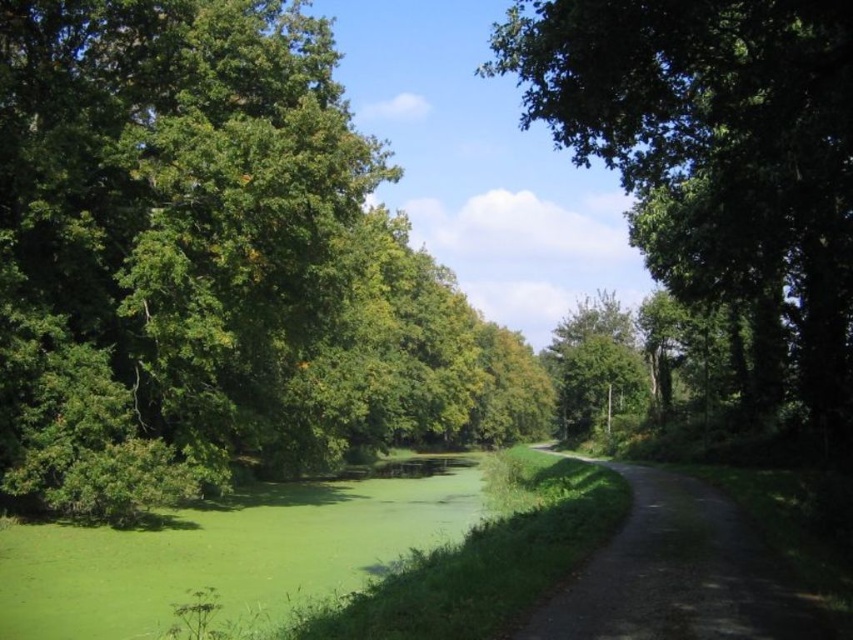
Question: Which of the following is the closest to the observer?

Choices:
 (A) (729, 163)
 (B) (202, 435)
 (C) (807, 625)
 (D) (585, 404)

Answer: (C)

Question: Does green leafy tree at left have a lesser width compared to dirt/gravel path at right?

Choices:
 (A) no
 (B) yes

Answer: (A)

Question: Is green leafy tree at left to the left of dirt/gravel path at right from the viewer's perspective?

Choices:
 (A) yes
 (B) no

Answer: (A)

Question: Which of these objects is positioned farthest from the green leafy tree at left?

Choices:
 (A) dirt/gravel path at right
 (B) green leafy tree at upper right

Answer: (A)

Question: Can you confirm if dirt/gravel path at right is positioned above green leafy tree at center?

Choices:
 (A) yes
 (B) no

Answer: (B)

Question: Which object is closer to the camera taking this photo?

Choices:
 (A) green leafy tree at left
 (B) green leafy tree at center
 (C) dirt/gravel path at right
 (D) green leafy tree at upper right

Answer: (C)